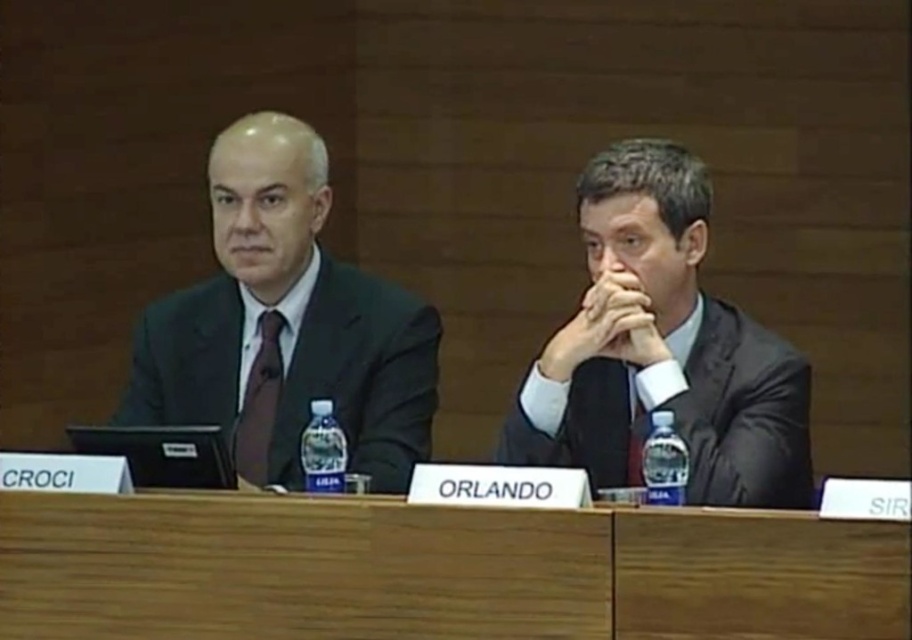
Question: In this image, where is matte black suit at left located relative to brown silk tie at left?

Choices:
 (A) above
 (B) below

Answer: (A)

Question: Can you confirm if matte black suit at left is smaller than brown silk tie at left?

Choices:
 (A) no
 (B) yes

Answer: (A)

Question: Which of the following is the farthest from the observer?

Choices:
 (A) dark gray suit at center
 (B) brown silk tie at left

Answer: (B)

Question: Which of the following is the farthest from the observer?

Choices:
 (A) (486, 524)
 (B) (258, 468)
 (C) (298, 381)
 (D) (519, 460)

Answer: (C)

Question: Observing the image, what is the correct spatial positioning of wooden at center in reference to dark gray suit at center?

Choices:
 (A) above
 (B) below

Answer: (B)

Question: Which object is farther from the camera taking this photo?

Choices:
 (A) dark gray suit at center
 (B) wooden at center

Answer: (A)